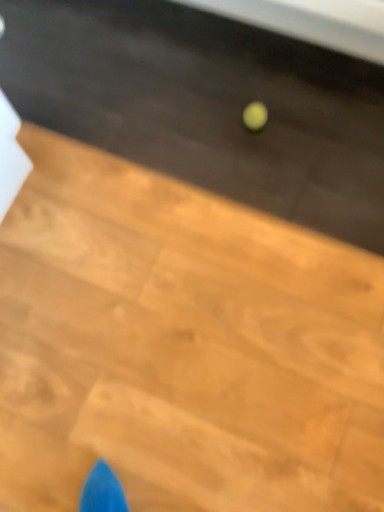
This screenshot has height=512, width=384. What do you see at coordinates (255, 116) in the screenshot?
I see `yellow matte tennis ball at upper center` at bounding box center [255, 116].

The width and height of the screenshot is (384, 512). I want to click on yellow matte tennis ball at upper center, so click(255, 116).

What is the approximate width of yellow matte tennis ball at upper center?

The width of yellow matte tennis ball at upper center is 4.18 inches.

Identify the location of yellow matte tennis ball at upper center. (255, 116).